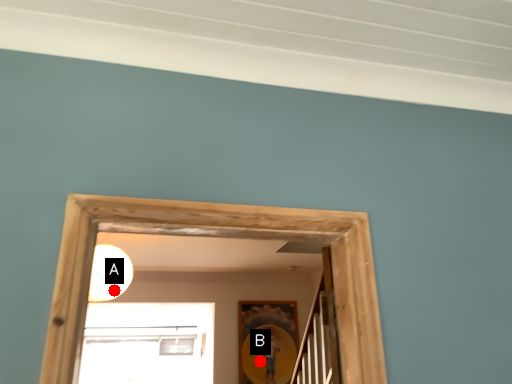
Question: Two points are circled on the image, labeled by A and B beside each circle. Among these points, which one is farthest from the camera?

Choices:
 (A) A is further
 (B) B is further

Answer: (B)